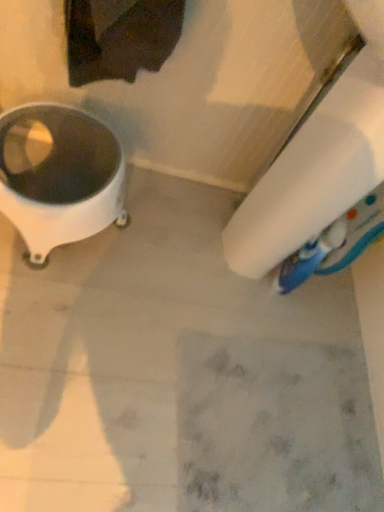
This screenshot has height=512, width=384. I want to click on vacant area that lies between white glossy toilet paper at lower right and white glossy waste container at left, so click(117, 244).